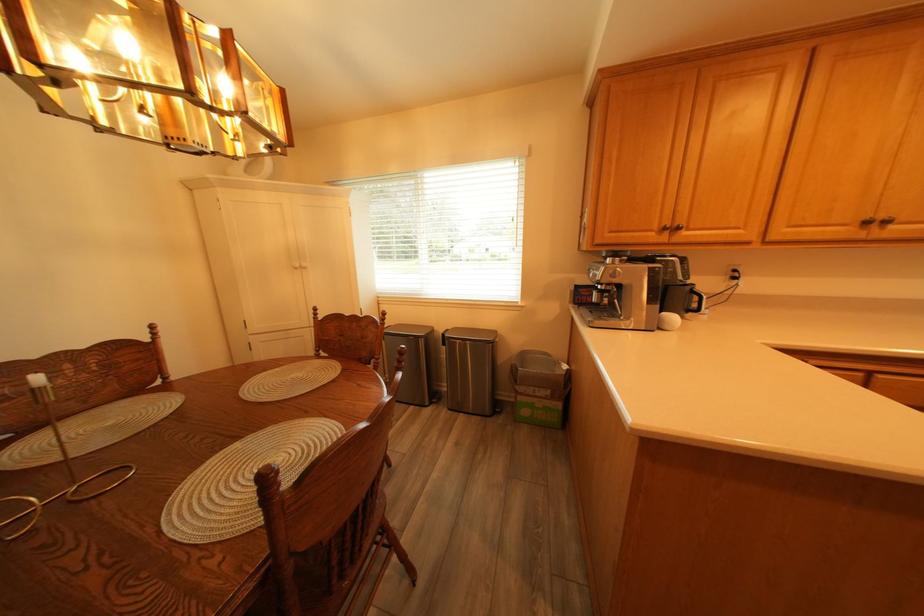
Identify the location of espresso machine handle. This screenshot has width=924, height=616. (614, 302).